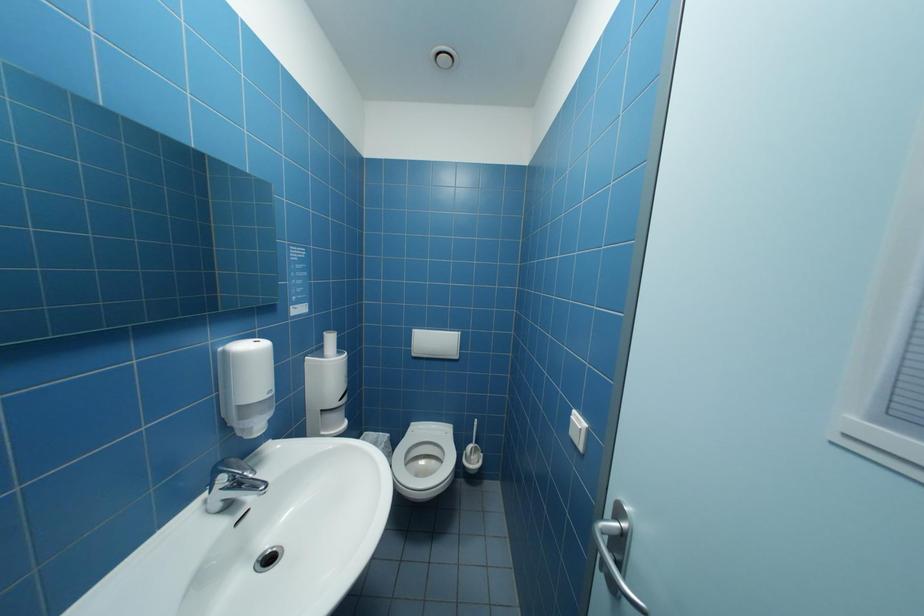
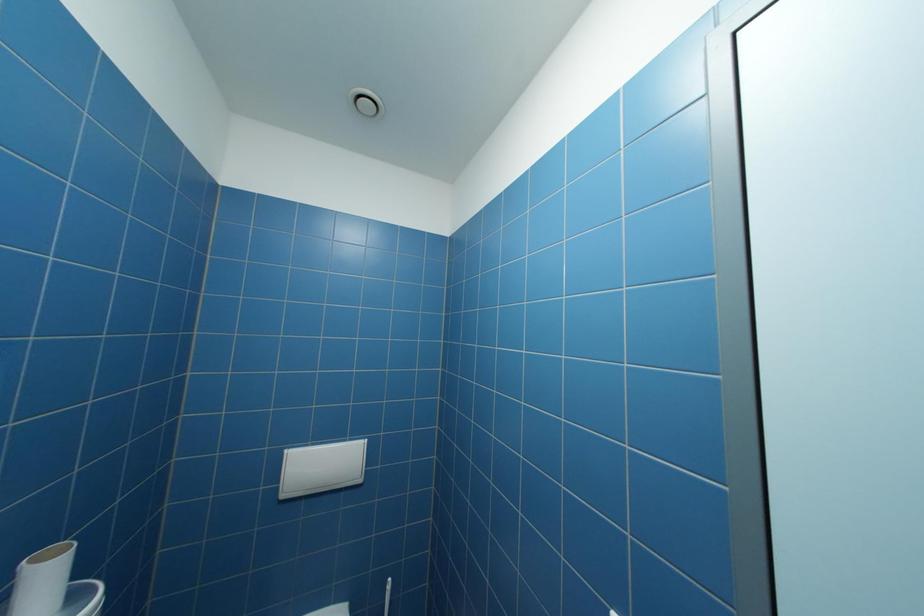
Which direction would the cameraman need to move to produce the second image?

The cameraman walked toward left, forward.